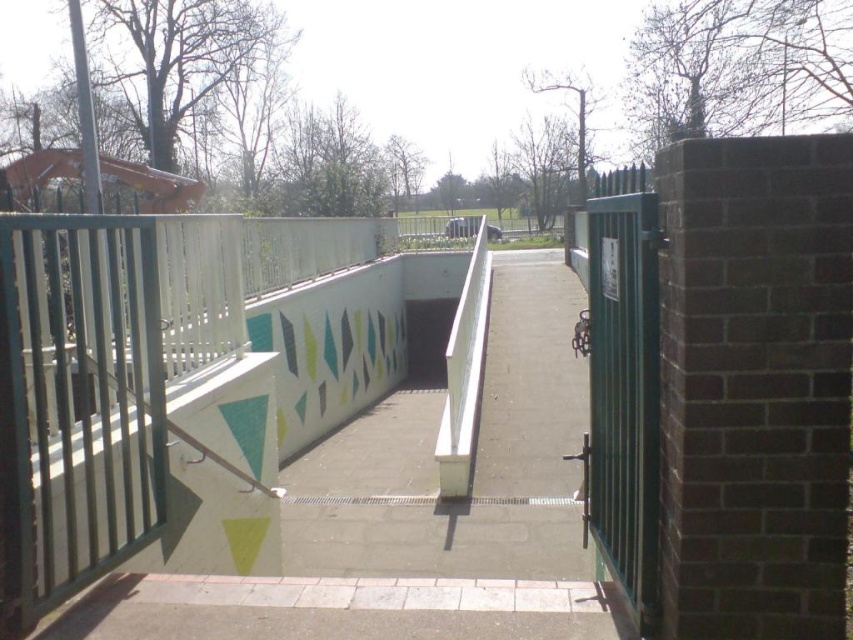
You are a delivery person carrying a box that is 3 meters long. You are standing at the camera position and want to place the box on the white concrete path at center. Can you fit the box on the path without any part of it hanging off?

The white concrete path at center is 2.89 meters from camera. Since the box is 3 meters long, which is longer than the path, it will not fit entirely on the path. Part of the box will hang off.

In the scene shown: You are standing at the entrance of the park and want to reach the lower level. There is a white concrete path at center. Which direction should you walk to go down to the lower level?

The white concrete path at center is located at point (x=416, y=509), so you should walk towards the center of the scene to reach the lower level.